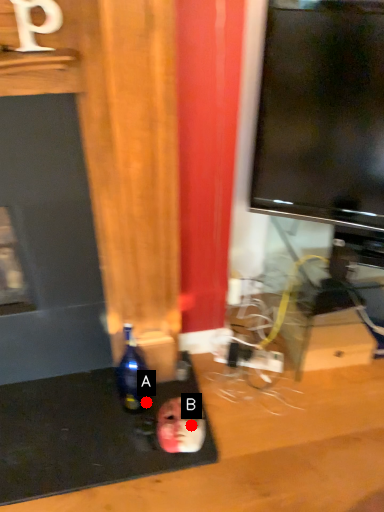
Question: Two points are circled on the image, labeled by A and B beside each circle. Which point is farther to the camera?

Choices:
 (A) A is further
 (B) B is further

Answer: (A)